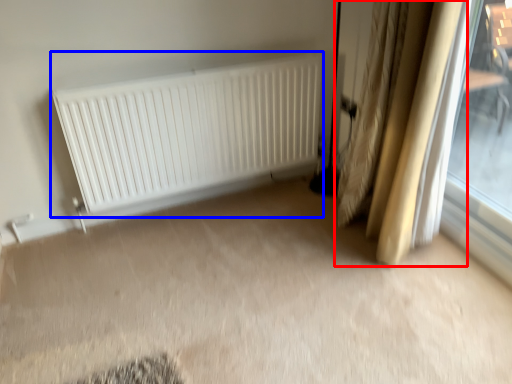
Question: Which object appears farthest to the camera in this image, curtain (highlighted by a red box) or radiator (highlighted by a blue box)?

Choices:
 (A) curtain
 (B) radiator

Answer: (B)